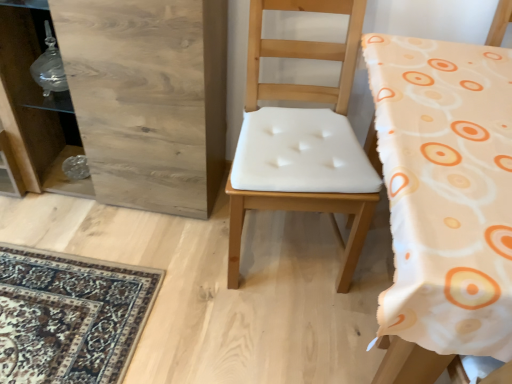
Question: Would you say wooden dresser at left is outside white fabric chair at center, the 1th chair viewed from the right?

Choices:
 (A) yes
 (B) no

Answer: (A)

Question: Is wooden dresser at left not near white fabric chair at center, which is the 2th chair in left-to-right order?

Choices:
 (A) no
 (B) yes

Answer: (B)

Question: Would you say white fabric chair at center, the 1th chair viewed from the right, is part of wooden dresser at left's contents?

Choices:
 (A) no
 (B) yes

Answer: (A)

Question: Could you tell me if wooden dresser at left is turned towards white fabric chair at center, which is the 2th chair in left-to-right order?

Choices:
 (A) yes
 (B) no

Answer: (B)

Question: Are wooden dresser at left and white fabric chair at center, the 1th chair viewed from the right, making contact?

Choices:
 (A) no
 (B) yes

Answer: (A)

Question: From a real-world perspective, relative to wooden dresser at left, is white fabric chair at center, which ranks as the first chair in left-to-right order, vertically above or below?

Choices:
 (A) above
 (B) below

Answer: (A)

Question: Considering the positions of point (256, 1) and point (118, 148), is point (256, 1) closer or farther from the camera than point (118, 148)?

Choices:
 (A) farther
 (B) closer

Answer: (B)

Question: In the image, is white fabric chair at center, arranged as the second chair when viewed from the right, positioned in front of or behind wooden dresser at left?

Choices:
 (A) front
 (B) behind

Answer: (A)

Question: Which is correct: white fabric chair at center, arranged as the second chair when viewed from the right, is inside wooden dresser at left, or outside of it?

Choices:
 (A) outside
 (B) inside

Answer: (A)

Question: Based on their sizes in the image, would you say white fabric chair at center, the 1th chair viewed from the right, is bigger or smaller than wooden dresser at left?

Choices:
 (A) small
 (B) big

Answer: (A)

Question: Is white fabric chair at center, the 1th chair viewed from the right, in front of or behind wooden dresser at left in the image?

Choices:
 (A) behind
 (B) front

Answer: (B)

Question: Which is correct: white fabric chair at center, the 1th chair viewed from the right, is inside wooden dresser at left, or outside of it?

Choices:
 (A) inside
 (B) outside

Answer: (B)

Question: Looking at their shapes, would you say white fabric chair at center, which is the 2th chair in left-to-right order, is wider or thinner than wooden dresser at left?

Choices:
 (A) thin
 (B) wide

Answer: (B)

Question: Considering their positions, is white fabric chair at center, the 1th chair viewed from the right, located in front of or behind white fabric chair at center, which ranks as the first chair in left-to-right order?

Choices:
 (A) behind
 (B) front

Answer: (B)

Question: Does point (411, 344) appear closer or farther from the camera than point (279, 49)?

Choices:
 (A) farther
 (B) closer

Answer: (B)